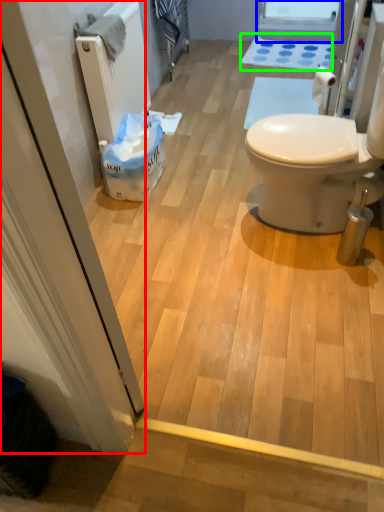
Question: Which object is the farthest from screen door (highlighted by a red box)? Choose among these: window screen (highlighted by a blue box) or bath mat (highlighted by a green box).

Choices:
 (A) window screen
 (B) bath mat

Answer: (A)